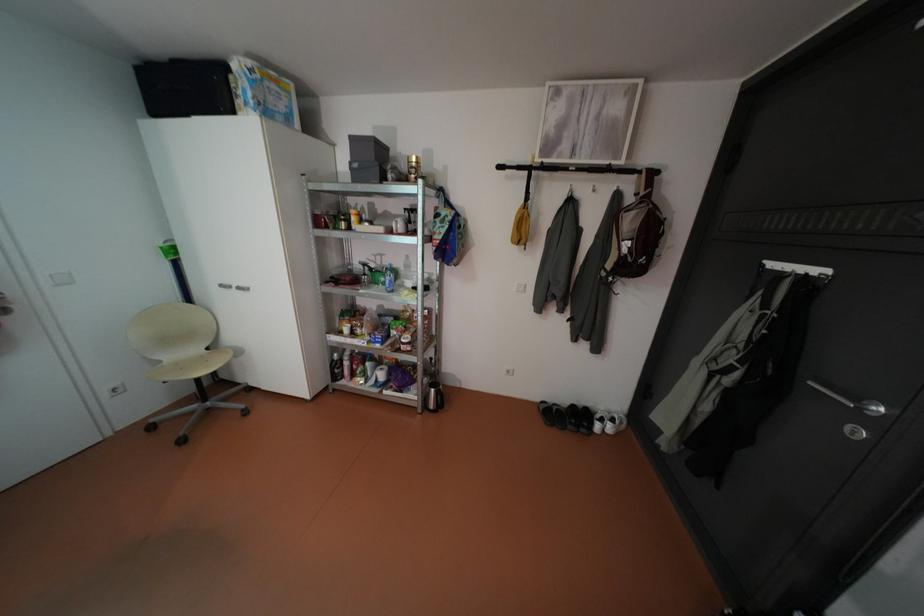
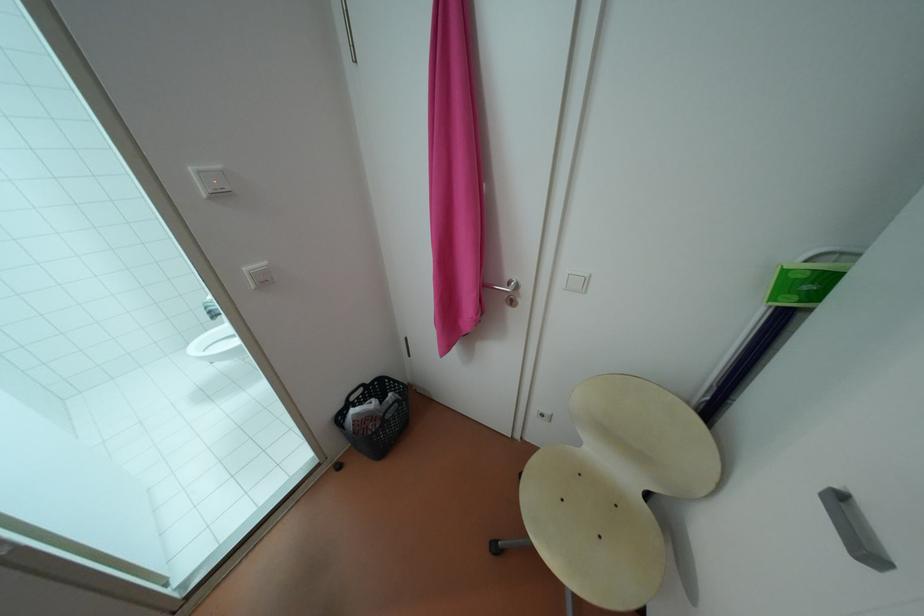
Where in the second image is the point corresponding to the point at 67,284 from the first image?

(576, 288)